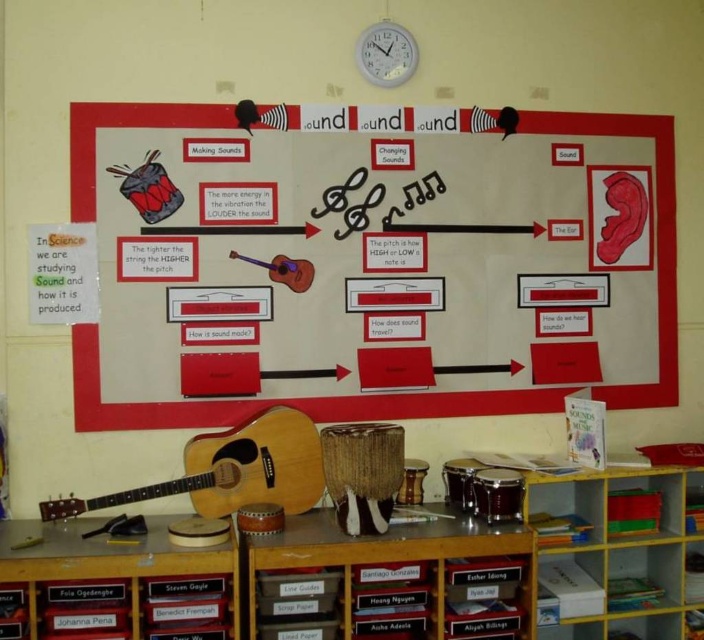
You are a student trying to hang a new poster on the classroom bulletin board. You have a matte white paper at center and a gray plastic clock at upper center. Which object is wider so you can decide where to place your poster?

The matte white paper at center is wider than the gray plastic clock at upper center, so you should place your poster on the wider matte white paper at center.

You are a student in the classroom and want to hang a new poster above the natural wood acoustic guitar at lower left and the gray plastic clock at upper center. Which object should you place the poster above so that it is taller than both?

The natural wood acoustic guitar at lower left is taller than the gray plastic clock at upper center. Therefore, you should place the poster above the natural wood acoustic guitar at lower left to ensure it is taller than both.

In the scene shown: You are a student trying to hang a new poster on the classroom bulletin board. You see the matte white paper at center and the matte brown guitar at center. Which object should you move first to make space?

The matte brown guitar at center is above the matte white paper at center. To make space, you should move the matte brown guitar at center first.